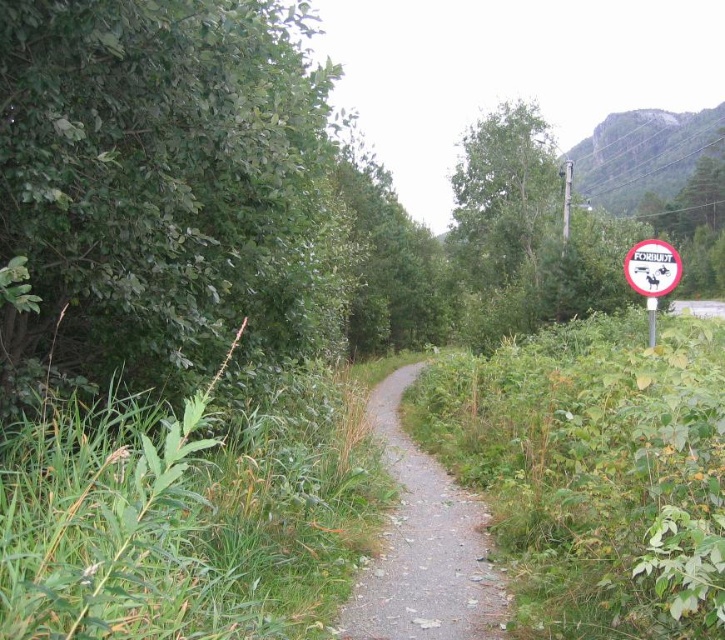
Question: Is gray gravel path at center smaller than green leafy tree at center?

Choices:
 (A) yes
 (B) no

Answer: (A)

Question: Which point is farther to the camera?

Choices:
 (A) gray gravel path at center
 (B) green leafy tree at left

Answer: (A)

Question: Is green leafy tree at center bigger than white plastic sign at right?

Choices:
 (A) no
 (B) yes

Answer: (B)

Question: Can you confirm if gray gravel path at center is thinner than white plastic sign at right?

Choices:
 (A) no
 (B) yes

Answer: (A)

Question: Which point appears farthest from the camera in this image?

Choices:
 (A) (397, 579)
 (B) (650, 323)
 (C) (212, 192)
 (D) (484, 136)

Answer: (D)

Question: Which point appears farthest from the camera in this image?

Choices:
 (A) (526, 300)
 (B) (372, 611)
 (C) (102, 355)
 (D) (666, 280)

Answer: (A)